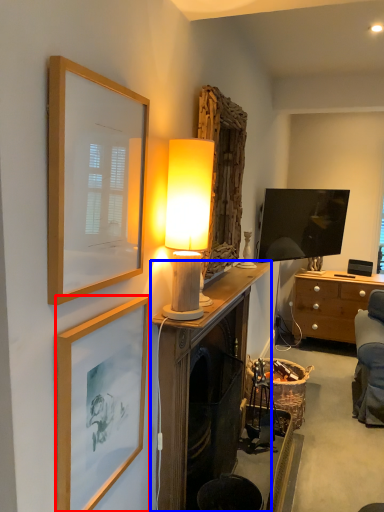
Question: Which object is further to the camera taking this photo, picture frame (highlighted by a red box) or cabinetry (highlighted by a blue box)?

Choices:
 (A) picture frame
 (B) cabinetry

Answer: (B)